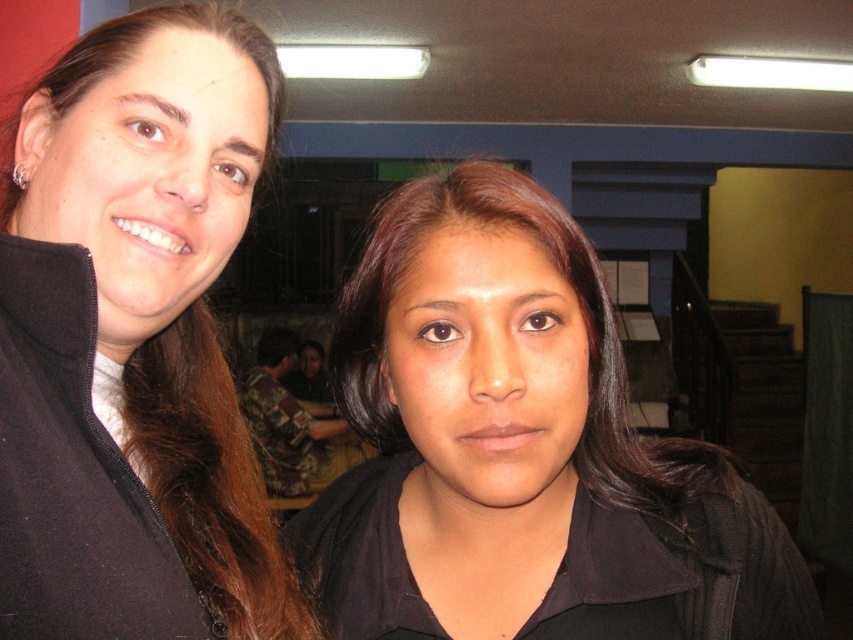
Can you confirm if black matte jacket at center is positioned below matte black jacket at left?

Indeed, black matte jacket at center is positioned under matte black jacket at left.

Which is above, black matte jacket at center or matte black jacket at left?

matte black jacket at left is higher up.

Is point (482, 536) farther from camera compared to point (142, 176)?

Yes.

You are a GUI agent. You are given a task and a screenshot of the screen. Output one action in this format:
    pyautogui.click(x=<x>, y=<y>)
    Task: Click on the black matte jacket at center
    The height and width of the screenshot is (640, 853).
    Given the screenshot: What is the action you would take?
    pyautogui.click(x=520, y=451)